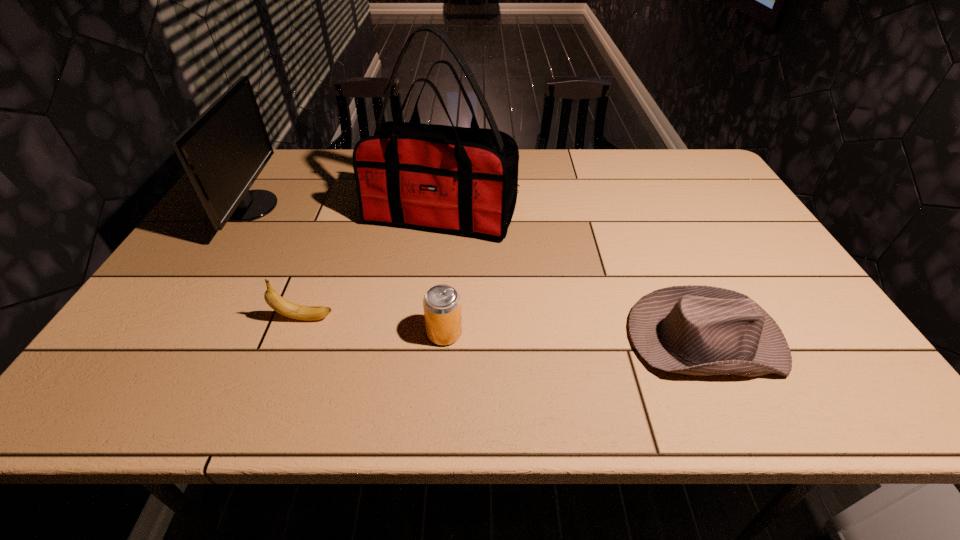
The height and width of the screenshot is (540, 960). I want to click on blank area at the far left corner, so click(x=278, y=168).

In the image, there is a desktop. Where is `blank space at the far right corner`? The height and width of the screenshot is (540, 960). blank space at the far right corner is located at coordinates tap(675, 158).

Locate an element on the screen. This screenshot has width=960, height=540. vacant space at the near right corner of the desktop is located at coordinates (792, 377).

I want to click on vacant point located between the banana and the pop (soda), so click(x=374, y=326).

Where is `unoccupied area between the tallest object and the pop (soda)`? unoccupied area between the tallest object and the pop (soda) is located at coordinates (444, 274).

You are a GUI agent. You are given a task and a screenshot of the screen. Output one action in this format:
    pyautogui.click(x=<x>, y=<y>)
    Task: Click on the free space between the fedora and the monitor
    
    Given the screenshot: What is the action you would take?
    pyautogui.click(x=477, y=273)

Where is `vacant point located between the tallest object and the rightmost object`? This screenshot has height=540, width=960. vacant point located between the tallest object and the rightmost object is located at coordinates (573, 277).

Where is `blank region between the pop (soda) and the fourth shortest object`? blank region between the pop (soda) and the fourth shortest object is located at coordinates (348, 270).

The width and height of the screenshot is (960, 540). I want to click on free space between the pop (soda) and the banana, so click(x=374, y=326).

Locate an element on the screen. vacant space that is in between the banana and the fedora is located at coordinates (505, 329).